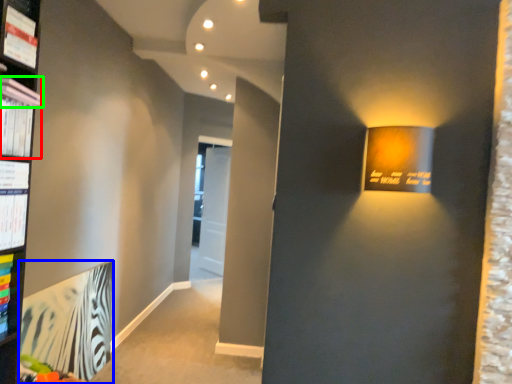
Question: Which object is the farthest from magazine (highlighted by a red box)? Choose among these: paperback book (highlighted by a blue box) or book (highlighted by a green box).

Choices:
 (A) paperback book
 (B) book

Answer: (A)